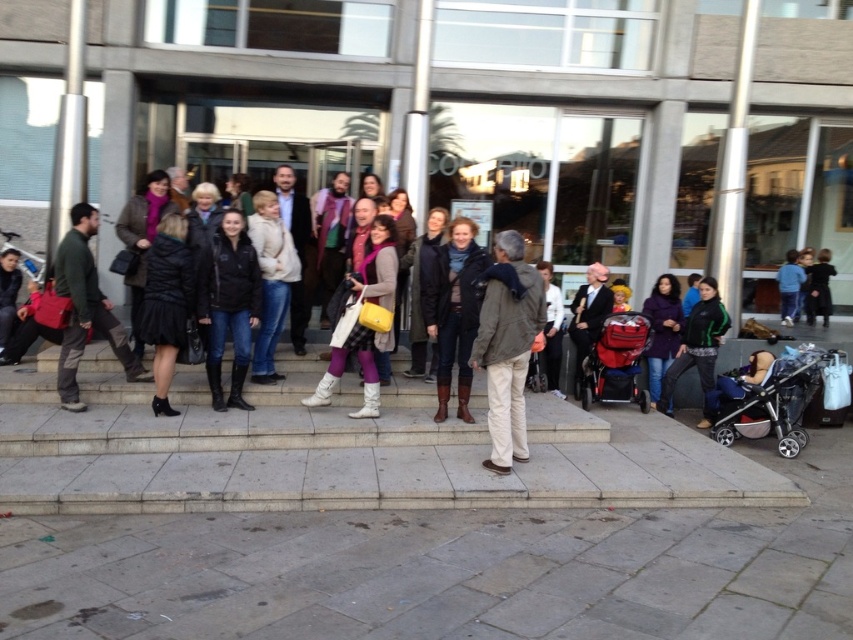
You are a photographer taking a picture of the group on the steps. You notice the matte yellow bag at center and the red plastic baby carriage at center. Which object is taller when viewed from above?

The matte yellow bag at center is taller than the red plastic baby carriage at center.

You are standing at the entrance of the modern building and want to reach the point marked as point (221, 272). However, there is an obstacle at point (630, 387). Can you walk directly to your destination without going around the obstacle?

Yes, because point (221, 272) is in front of point (630, 387), meaning the obstacle is behind your destination, so you can walk directly to point (221, 272) without needing to go around.

From the picture: You are standing at the entrance of the building and want to find the leather boots at center. According to the coordinates given, in which direction should you look to find them?

The leather boots at center are located at coordinates approximately 0.486 on the x and 0.532 on the y axis. Since the center of the image is typically at 0.5, the boots are slightly to the left and above the exact center point.